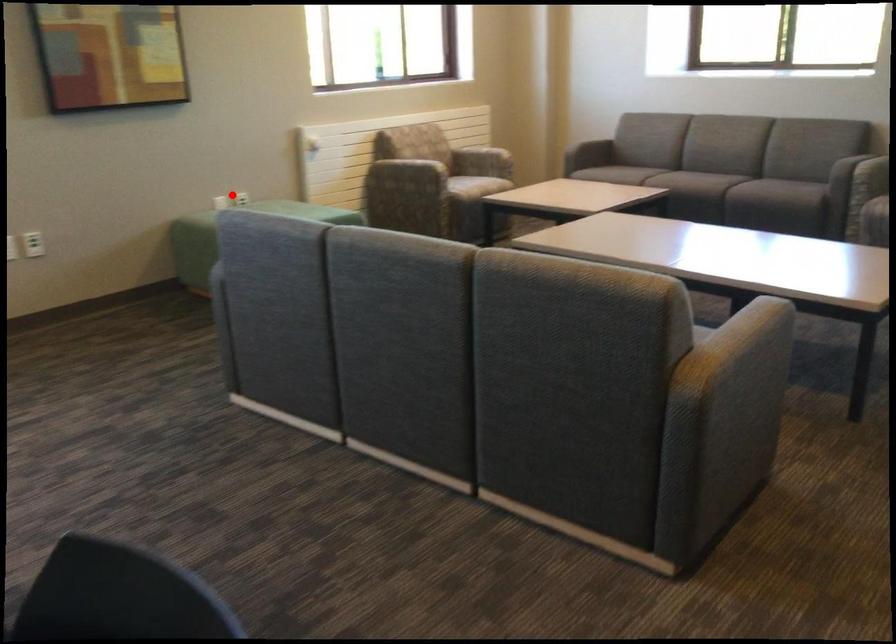
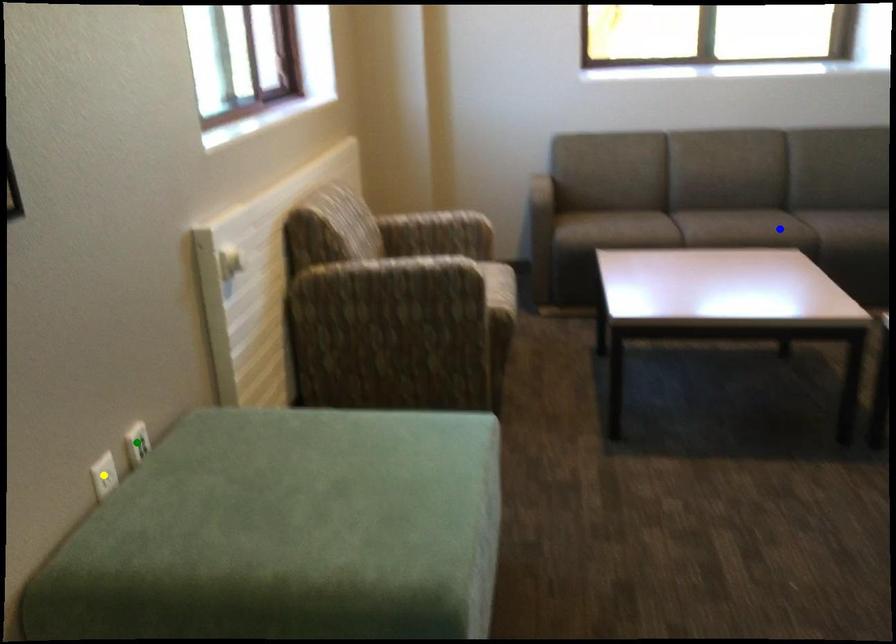
Question: I am providing you with two images of the same scene from different viewpoints. A red point is marked on the first image. You are given multiple points on the second image. Which point in image 2 represents the same 3d spot as the red point in image 1?

Choices:
 (A) blue point
 (B) green point
 (C) yellow point

Answer: (B)